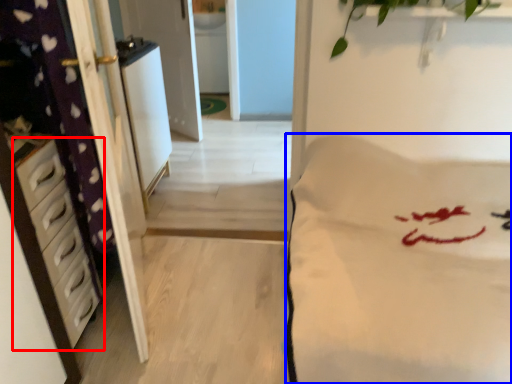
Question: Which object appears farthest to the camera in this image, chest of drawers (highlighted by a red box) or mattress (highlighted by a blue box)?

Choices:
 (A) chest of drawers
 (B) mattress

Answer: (A)